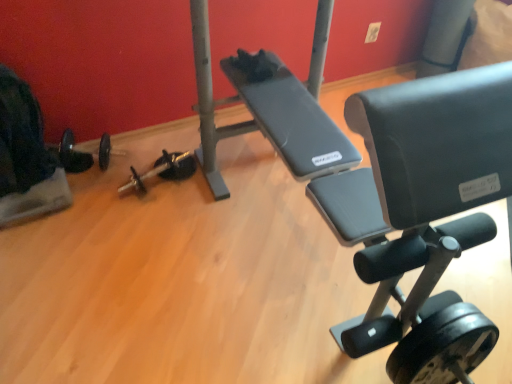
Image resolution: width=512 pixels, height=384 pixels. Find the location of `blank area beneath velvet black swivel chair at left (from a real-world perspective)`. blank area beneath velvet black swivel chair at left (from a real-world perspective) is located at coordinates (35, 178).